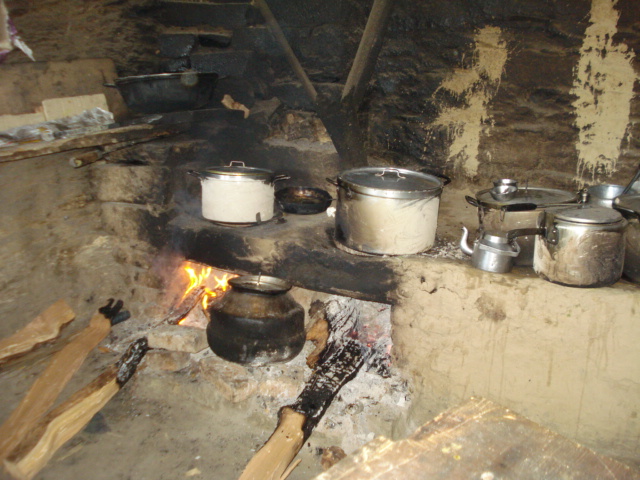
Find the location of a particular element. The image size is (640, 480). pot handle is located at coordinates (521, 231).